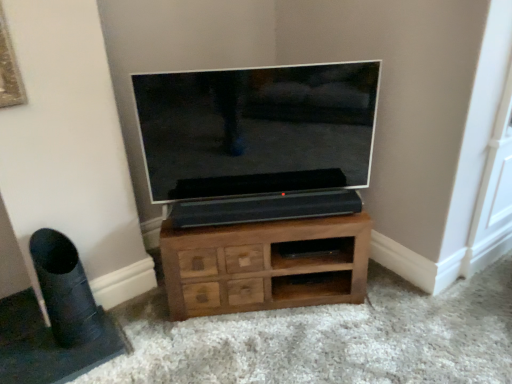
The height and width of the screenshot is (384, 512). Find the location of `vacant area located to the right-hand side of black matte speaker at lower left`. vacant area located to the right-hand side of black matte speaker at lower left is located at coordinates (110, 342).